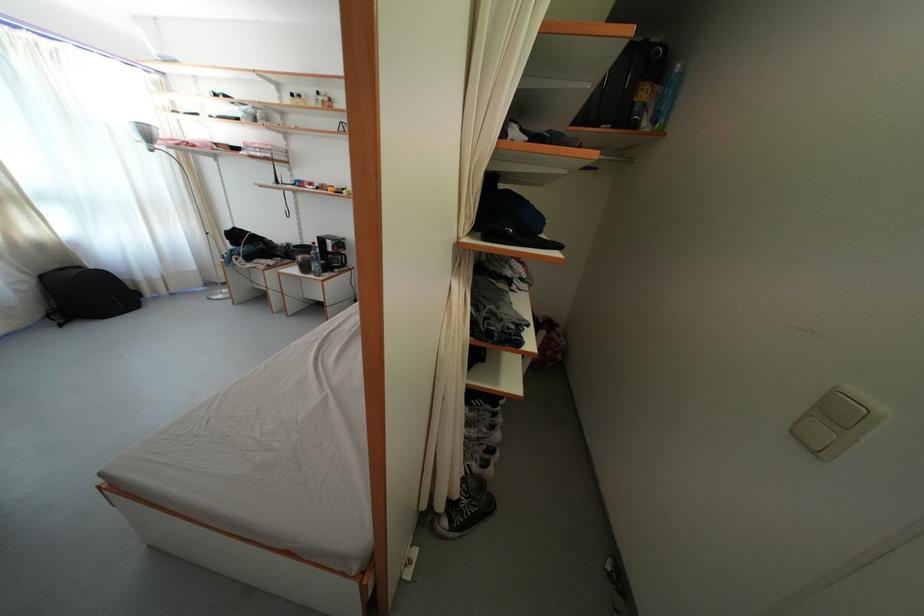
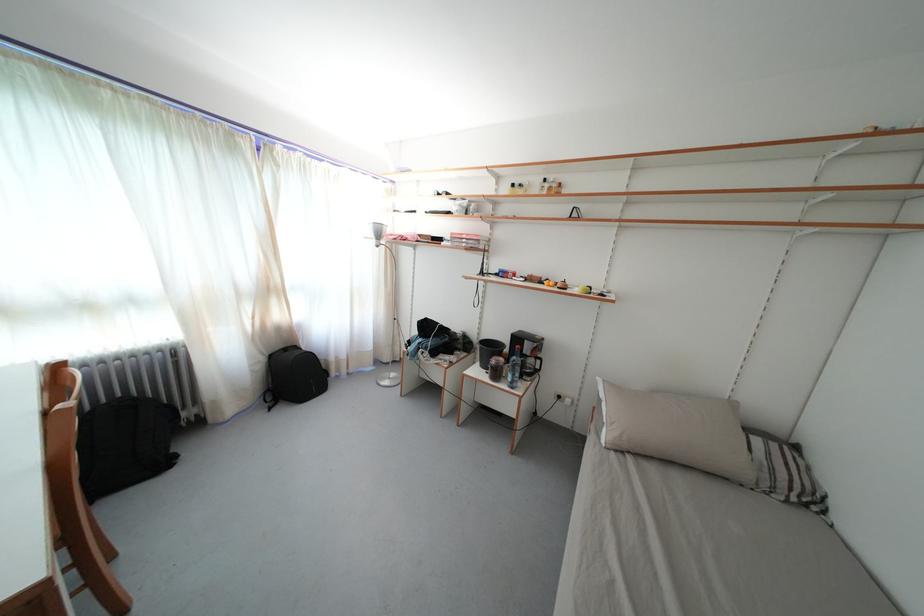
Find the pixel in the second image that matches (144,143) in the first image.

(378, 241)